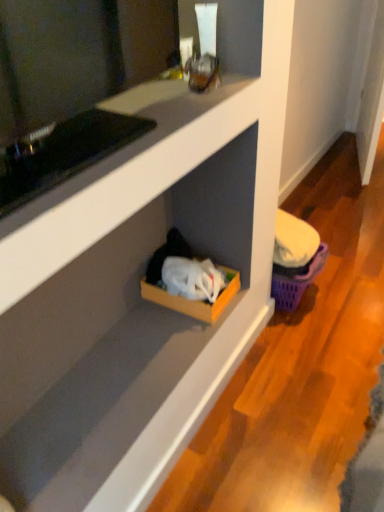
Question: Relative to wooden cardboard box at lower center, is purple plastic basket at lower right in front or behind?

Choices:
 (A) behind
 (B) front

Answer: (A)

Question: From the image's perspective, relative to wooden cardboard box at lower center, is purple plastic basket at lower right above or below?

Choices:
 (A) above
 (B) below

Answer: (A)

Question: Is purple plastic basket at lower right spatially inside wooden cardboard box at lower center, or outside of it?

Choices:
 (A) outside
 (B) inside

Answer: (A)

Question: Relative to purple plastic basket at lower right, is wooden cardboard box at lower center in front or behind?

Choices:
 (A) front
 (B) behind

Answer: (A)

Question: Choose the correct answer: Is wooden cardboard box at lower center inside purple plastic basket at lower right or outside it?

Choices:
 (A) inside
 (B) outside

Answer: (B)

Question: From the image's perspective, is wooden cardboard box at lower center located above or below purple plastic basket at lower right?

Choices:
 (A) below
 (B) above

Answer: (A)

Question: Would you say wooden cardboard box at lower center is to the left or to the right of purple plastic basket at lower right in the picture?

Choices:
 (A) left
 (B) right

Answer: (A)